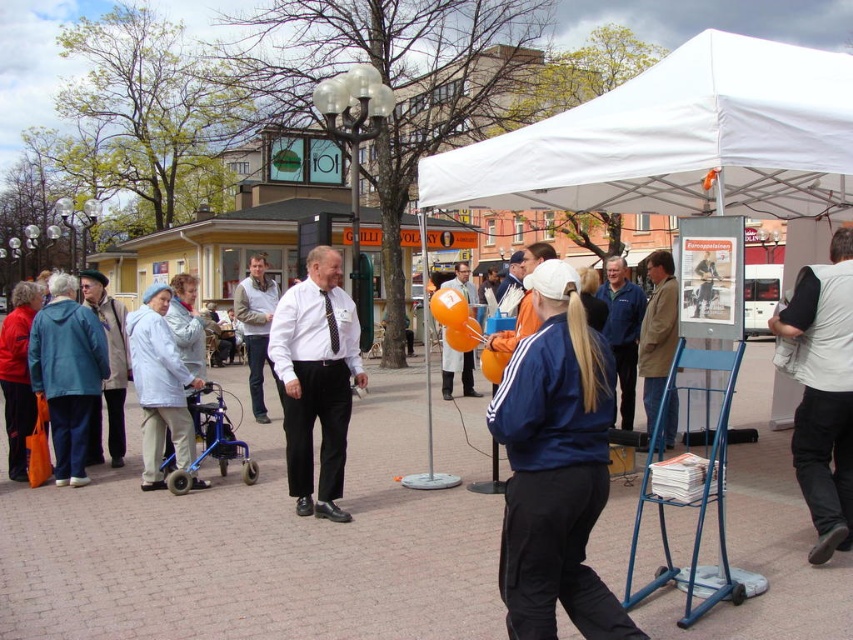
You are a photographer trying to capture a group photo of the white shirt and tie at center and the teal fabric jacket at left. The camera can only fit one of them in the frame due to their sizes. Which person should you focus on to ensure they fit entirely in the photo?

The white shirt and tie at center has a smaller width than the teal fabric jacket at left, so focusing on the white shirt and tie at center ensures they will fit entirely in the photo.

You are a photographer positioned in the square and want to capture both the light blue fabric jacket at left and the white fleece vest at center in a single frame. Which object should you focus on first to ensure both are in the shot?

You should focus on the white fleece vest at center first because the light blue fabric jacket at left is positioned below it, so adjusting the camera angle to include the lower area will capture both.